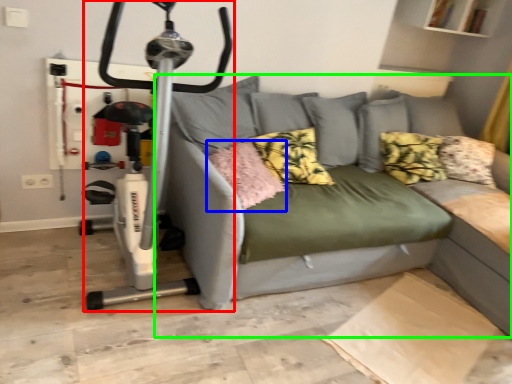
Question: Which object is positioned closest to sport equipment (highlighted by a red box)? Select from pillow (highlighted by a blue box) and studio couch (highlighted by a green box).

Choices:
 (A) pillow
 (B) studio couch

Answer: (A)